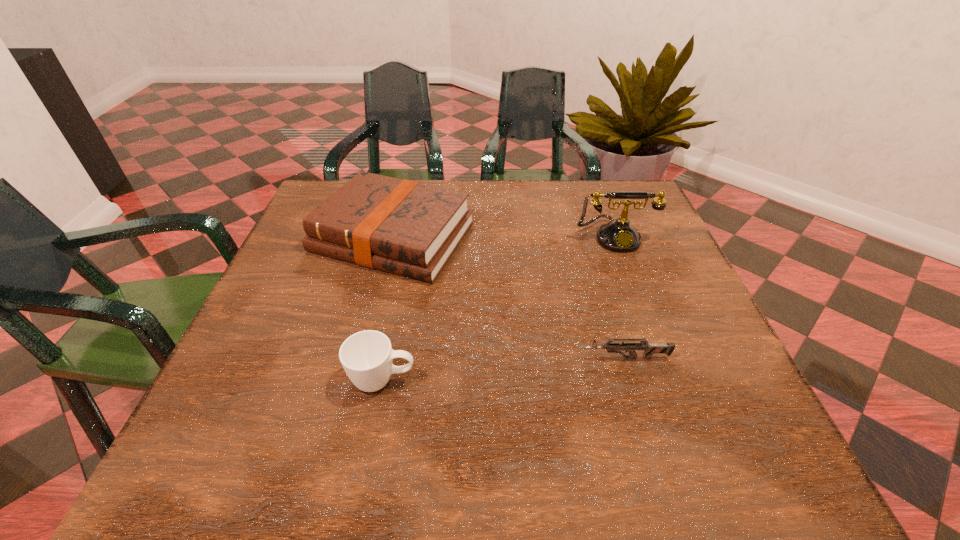
In the image, there is a desktop. Identify the location of blank space at the left edge. (275, 349).

Find the location of `free space at the right edge`. free space at the right edge is located at coordinates (709, 346).

This screenshot has height=540, width=960. I want to click on vacant space at the far left corner of the desktop, so click(x=327, y=187).

This screenshot has width=960, height=540. I want to click on vacant region at the near left corner of the desktop, so click(x=269, y=441).

Image resolution: width=960 pixels, height=540 pixels. In order to click on vacant space at the near right corner of the desktop in this screenshot , I will do `click(770, 473)`.

Image resolution: width=960 pixels, height=540 pixels. Find the location of `free space that is in between the telephone and the hardback book`. free space that is in between the telephone and the hardback book is located at coordinates (504, 237).

I want to click on free space between the hardback book and the second nearest object, so click(509, 298).

The width and height of the screenshot is (960, 540). I want to click on vacant space that is in between the gun and the cup, so click(x=503, y=369).

Locate an element on the screen. empty space between the telephone and the nearest object is located at coordinates (498, 308).

Find the location of a particular element. This screenshot has width=960, height=540. free space between the telephone and the shortest object is located at coordinates (618, 297).